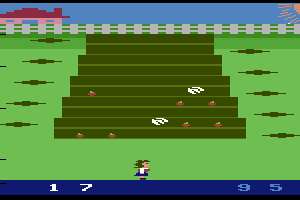
The height and width of the screenshot is (200, 300). Identify the location of plant. (281, 136), (273, 116), (266, 91), (259, 75), (256, 46), (25, 125), (30, 103), (37, 81), (40, 61), (52, 40).